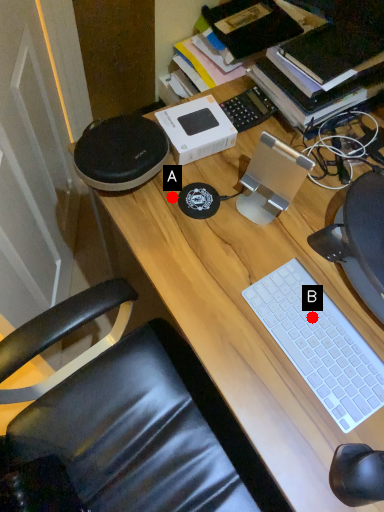
Question: Two points are circled on the image, labeled by A and B beside each circle. Which point is closer to the camera?

Choices:
 (A) A is closer
 (B) B is closer

Answer: (B)